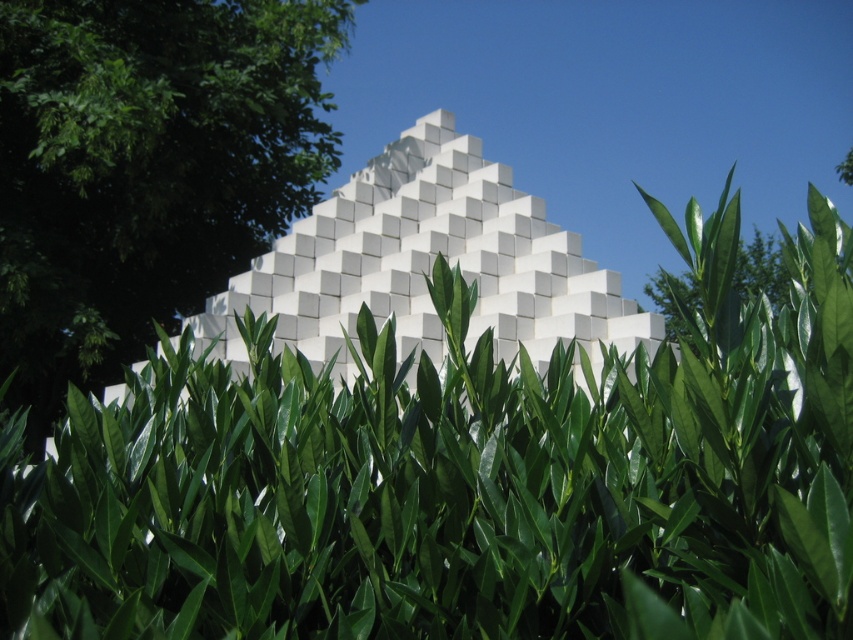
Which is above, green leafy hedge at center or white matte cube at center?

Positioned higher is green leafy hedge at center.

Does green leafy hedge at center have a lesser width compared to white matte cube at center?

In fact, green leafy hedge at center might be wider than white matte cube at center.

Does point (231, 579) come in front of point (328, 209)?

That is True.

You are a GUI agent. You are given a task and a screenshot of the screen. Output one action in this format:
    pyautogui.click(x=<x>, y=<y>)
    Task: Click on the green leafy hedge at center
    
    Given the screenshot: What is the action you would take?
    pyautogui.click(x=463, y=481)

Who is shorter, green leafy tree at center or white matte cube at center?

With less height is green leafy tree at center.

Is green leafy tree at center shorter than white matte cube at center?

Indeed, green leafy tree at center has a lesser height compared to white matte cube at center.

You are a GUI agent. You are given a task and a screenshot of the screen. Output one action in this format:
    pyautogui.click(x=<x>, y=<y>)
    Task: Click on the green leafy tree at center
    The image size is (853, 640).
    Given the screenshot: What is the action you would take?
    click(144, 168)

Is green leafy hedge at center smaller than green leafy tree at center?

No, green leafy hedge at center is not smaller than green leafy tree at center.

Is green leafy hedge at center thinner than green leafy tree at center?

Incorrect, green leafy hedge at center's width is not less than green leafy tree at center's.

Describe the element at coordinates (463, 481) in the screenshot. I see `green leafy hedge at center` at that location.

Find the location of a particular element. This screenshot has width=853, height=640. green leafy hedge at center is located at coordinates (463, 481).